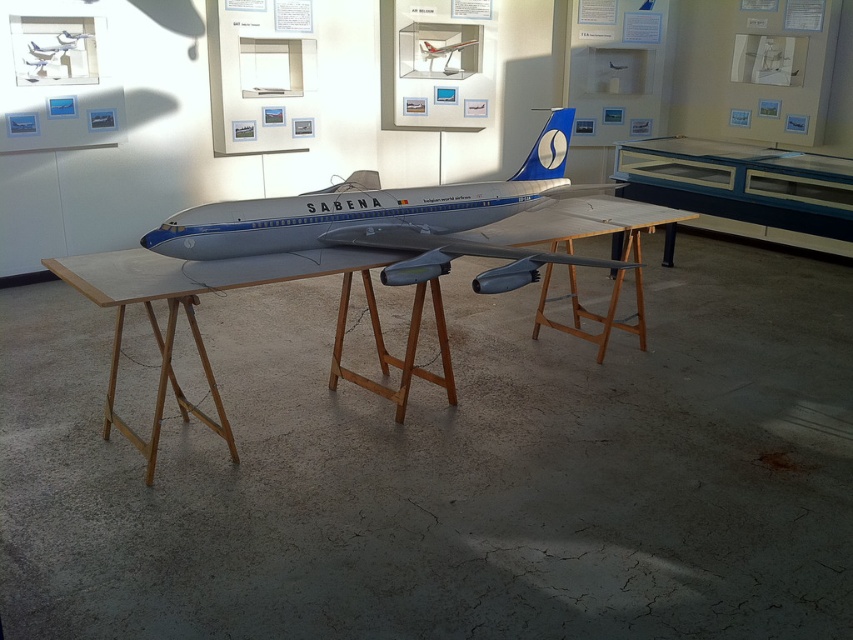
Based on the photo, you are an interior designer planning to place a new decorative item between the wooden at center and the matte silver airplane at upper center. Considering their sizes, which object should the new item be placed closer to?

The wooden at center is larger in size than the matte silver airplane at upper center, so the new item should be placed closer to the matte silver airplane at upper center to balance the visual weight.

You are an interior designer planning to install a new lighting fixture in the museum. You need to decide whether to place it above the wooden at center or the transparent glass display case at center. Based on their positions, which object should the light be positioned above to best illuminate both?

The wooden at center is located below the transparent glass display case at center. To best illuminate both, the light should be placed above the transparent glass display case at center so that its light can reach both the display case and the wooden table beneath it.